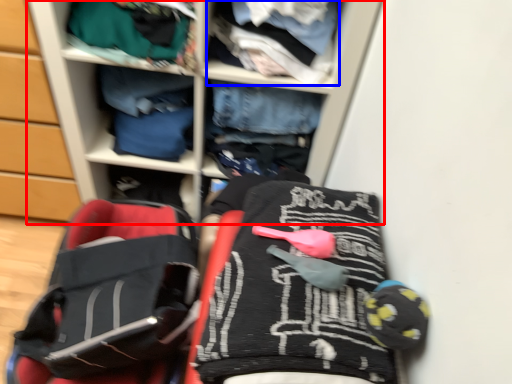
Question: Which of the following is the closest to the observer, shelf (highlighted by a red box) or clothing (highlighted by a blue box)?

Choices:
 (A) shelf
 (B) clothing

Answer: (A)